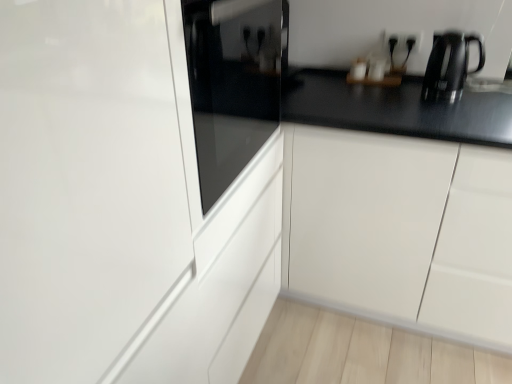
Question: Is glossy white glass door at center bigger than black metallic kettle at upper right?

Choices:
 (A) yes
 (B) no

Answer: (A)

Question: From the image's perspective, would you say glossy white glass door at center is shown under black metallic kettle at upper right?

Choices:
 (A) yes
 (B) no

Answer: (A)

Question: Is glossy white glass door at center in front of black metallic kettle at upper right?

Choices:
 (A) no
 (B) yes

Answer: (B)

Question: Does glossy white glass door at center turn towards black metallic kettle at upper right?

Choices:
 (A) no
 (B) yes

Answer: (A)

Question: Would you consider glossy white glass door at center to be distant from black metallic kettle at upper right?

Choices:
 (A) yes
 (B) no

Answer: (A)

Question: In the image, is glossy white glass door at center on the left side or the right side of black plastic electric outlet at upper right?

Choices:
 (A) right
 (B) left

Answer: (B)

Question: Is point (38, 210) positioned closer to the camera than point (398, 43)?

Choices:
 (A) farther
 (B) closer

Answer: (B)

Question: Considering the positions of glossy white glass door at center and black plastic electric outlet at upper right in the image, is glossy white glass door at center taller or shorter than black plastic electric outlet at upper right?

Choices:
 (A) short
 (B) tall

Answer: (B)

Question: From a real-world perspective, is glossy white glass door at center above or below black plastic electric outlet at upper right?

Choices:
 (A) below
 (B) above

Answer: (A)

Question: Is point (450, 84) positioned closer to the camera than point (484, 284)?

Choices:
 (A) farther
 (B) closer

Answer: (A)

Question: Is black metallic kettle at upper right inside the boundaries of glossy white cabinet at center, or outside?

Choices:
 (A) inside
 (B) outside

Answer: (B)

Question: Considering the positions of black metallic kettle at upper right and glossy white cabinet at center in the image, is black metallic kettle at upper right wider or thinner than glossy white cabinet at center?

Choices:
 (A) thin
 (B) wide

Answer: (A)

Question: From the image's perspective, relative to glossy white cabinet at center, is black metallic kettle at upper right above or below?

Choices:
 (A) above
 (B) below

Answer: (A)

Question: From a real-world perspective, is glossy white cabinet at center positioned above or below black metallic kettle at upper right?

Choices:
 (A) below
 (B) above

Answer: (A)

Question: From the image's perspective, relative to black metallic kettle at upper right, is glossy white cabinet at center above or below?

Choices:
 (A) below
 (B) above

Answer: (A)